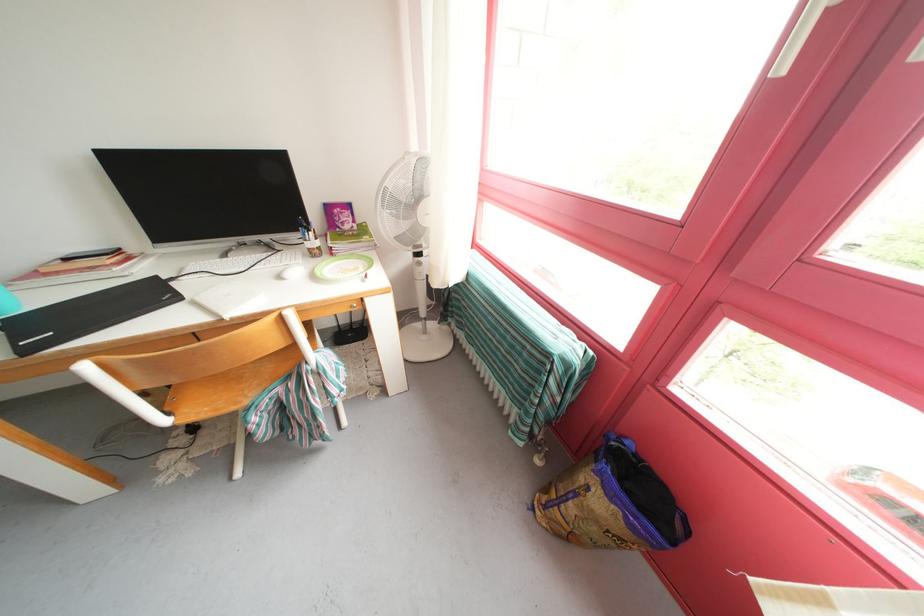
Where is `large tote bag`? The height and width of the screenshot is (616, 924). large tote bag is located at coordinates (612, 503).